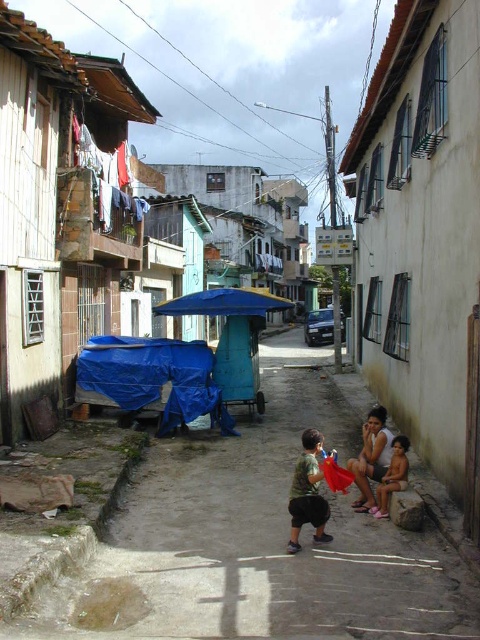
Question: Which of these objects is positioned closest to the matte pink shorts at lower right?

Choices:
 (A) blue tarpaulin at lower left
 (B) blue tarpaulin cart at center
 (C) white fabric clothes at upper left

Answer: (B)

Question: Which object is positioned farthest from the beige concrete hut at lower right?

Choices:
 (A) matte pink shorts at lower right
 (B) light brown skin at lower right
 (C) white fabric clothes at upper left
 (D) blue tarpaulin cart at center

Answer: (C)

Question: Does blue tarpaulin at lower left appear under camouflage fabric shirt at center?

Choices:
 (A) no
 (B) yes

Answer: (A)

Question: Is white fabric clothes at upper left above camouflage fabric shirt at center?

Choices:
 (A) no
 (B) yes

Answer: (B)

Question: Based on their relative distances, which object is farther from the beige concrete hut at lower right?

Choices:
 (A) matte pink shorts at lower right
 (B) white fabric clothes at upper left
 (C) camouflage fabric shirt at center
 (D) blue tarpaulin cart at center

Answer: (B)

Question: Is blue tarpaulin cart at center closer to the viewer compared to camouflage fabric shirt at center?

Choices:
 (A) yes
 (B) no

Answer: (A)